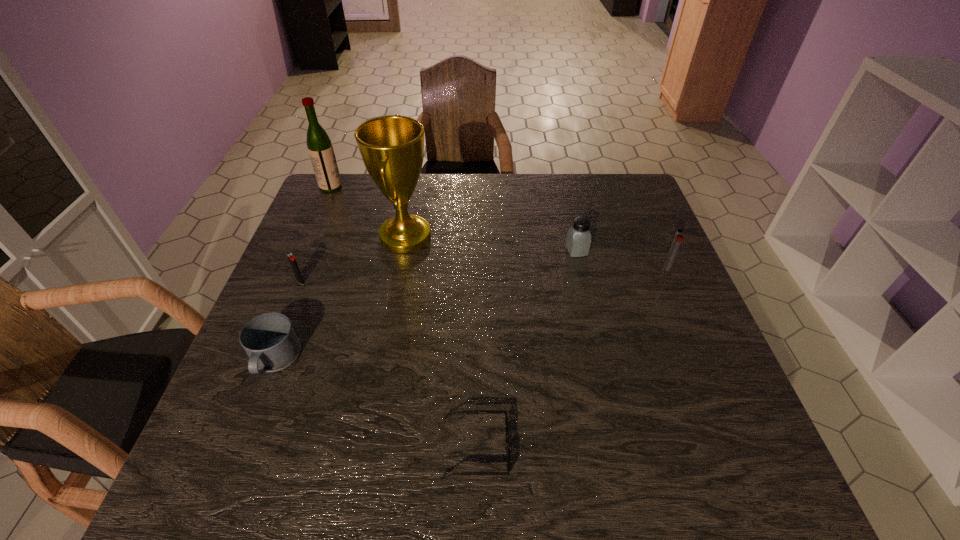
Where is `award`? award is located at coordinates (392, 147).

Where is `liquor`? liquor is located at coordinates (320, 148).

Locate an element on the screen. This screenshot has height=540, width=960. the right igniter is located at coordinates (677, 240).

At what (x,y) coordinates should I click in order to perform the action: click on the rightmost object. Please return your answer as a coordinate pair (x, y). The height and width of the screenshot is (540, 960). Looking at the image, I should click on (677, 240).

Find the location of a particular element. The height and width of the screenshot is (540, 960). the second object from right to left is located at coordinates (578, 240).

Where is `the shorter igniter`? The image size is (960, 540). the shorter igniter is located at coordinates (291, 258).

Locate an element on the screen. This screenshot has height=540, width=960. the left igniter is located at coordinates (291, 258).

At what (x,y) coordinates should I click in order to perform the action: click on the sixth farthest object. Please return your answer as a coordinate pair (x, y). This screenshot has height=540, width=960. Looking at the image, I should click on (269, 339).

The height and width of the screenshot is (540, 960). What are the coordinates of `mug` in the screenshot? It's located at (269, 339).

The width and height of the screenshot is (960, 540). What are the coordinates of `the nearest object` in the screenshot? It's located at (507, 449).